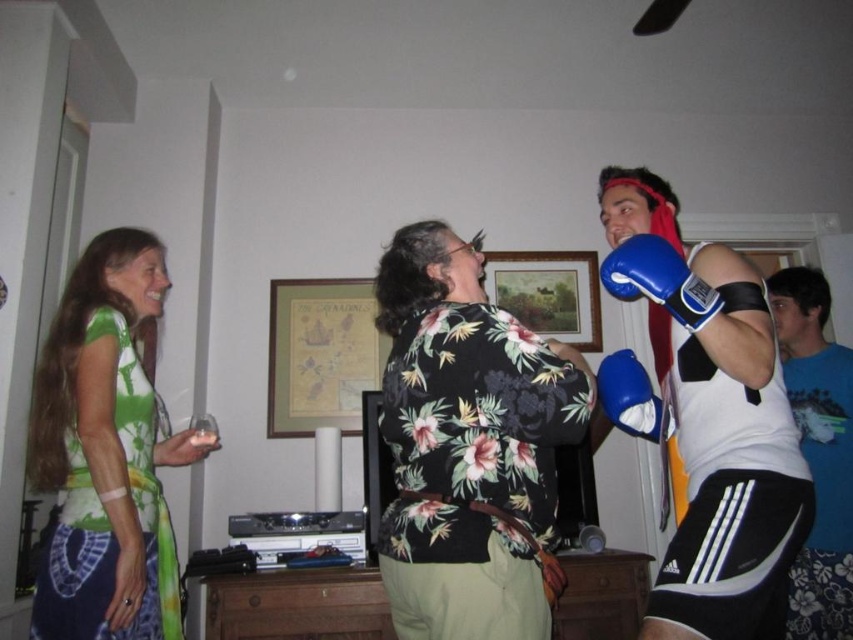
Does floral print shirt at center lie in front of green tie-dye shirt at left?

Yes, it is in front of green tie-dye shirt at left.

Is floral print shirt at center further to camera compared to green tie-dye shirt at left?

No.

Between point (538, 481) and point (111, 547), which one is positioned in front?

Point (538, 481)

You are a GUI agent. You are given a task and a screenshot of the screen. Output one action in this format:
    pyautogui.click(x=<x>, y=<y>)
    Task: Click on the floral print shirt at center
    The width and height of the screenshot is (853, 640).
    Given the screenshot: What is the action you would take?
    pyautogui.click(x=468, y=445)

Which is more to the left, blue synthetic boxing gloves at right or blue synthetic boxing glove at right?

From the viewer's perspective, blue synthetic boxing glove at right appears more on the left side.

Can you confirm if blue synthetic boxing gloves at right is bigger than blue synthetic boxing glove at right?

Yes.

Locate an element on the screen. This screenshot has height=640, width=853. blue synthetic boxing gloves at right is located at coordinates (718, 436).

Based on the photo, between green tie-dye shirt at left and blue fabric shirt at right, which one appears on the left side from the viewer's perspective?

From the viewer's perspective, green tie-dye shirt at left appears more on the left side.

The image size is (853, 640). Describe the element at coordinates (105, 452) in the screenshot. I see `green tie-dye shirt at left` at that location.

You are a GUI agent. You are given a task and a screenshot of the screen. Output one action in this format:
    pyautogui.click(x=<x>, y=<y>)
    Task: Click on the green tie-dye shirt at left
    
    Given the screenshot: What is the action you would take?
    point(105,452)